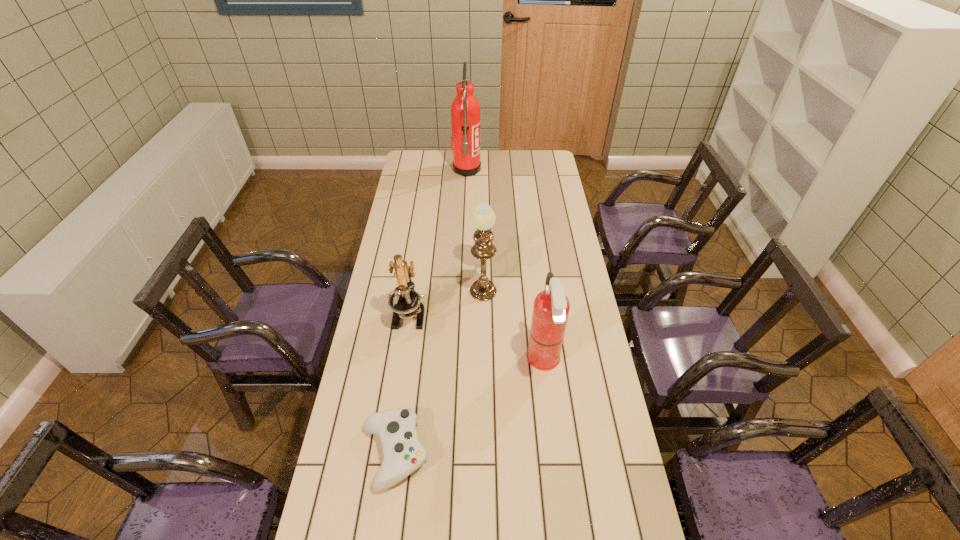
Find the location of a particular element. free space located with the handle and hose on the second nearest object is located at coordinates (442, 361).

You are a GUI agent. You are given a task and a screenshot of the screen. Output one action in this format:
    pyautogui.click(x=<x>, y=<y>)
    Task: Click on the vacant space located 0.260m with the handle and hose on the second nearest object
    Image resolution: width=960 pixels, height=540 pixels.
    Given the screenshot: What is the action you would take?
    pyautogui.click(x=448, y=361)

Locate an element on the screen. The width and height of the screenshot is (960, 540). vacant area located on the back of the oil lamp is located at coordinates coord(483,234).

Image resolution: width=960 pixels, height=540 pixels. I want to click on vacant space located 0.120m at the eyepiece of the microscope, so click(x=402, y=364).

I want to click on vacant area situated 0.260m on the right of the control, so [521, 454].

Locate an element on the screen. The height and width of the screenshot is (540, 960). object that is positioned at the far edge is located at coordinates (465, 110).

Image resolution: width=960 pixels, height=540 pixels. Identify the location of microscope located at the left edge. (405, 302).

This screenshot has width=960, height=540. Find the location of `control that is at the left edge`. control that is at the left edge is located at coordinates (402, 453).

I want to click on object that is at the right edge, so click(x=551, y=307).

The height and width of the screenshot is (540, 960). I want to click on vacant point at the far edge, so click(x=491, y=153).